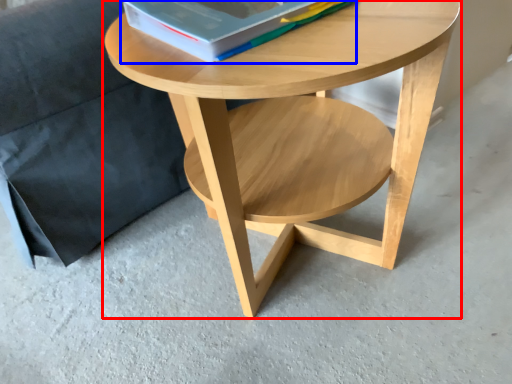
Question: Which point is further to the camera, coffee table (highlighted by a red box) or paperback book (highlighted by a blue box)?

Choices:
 (A) coffee table
 (B) paperback book

Answer: (B)